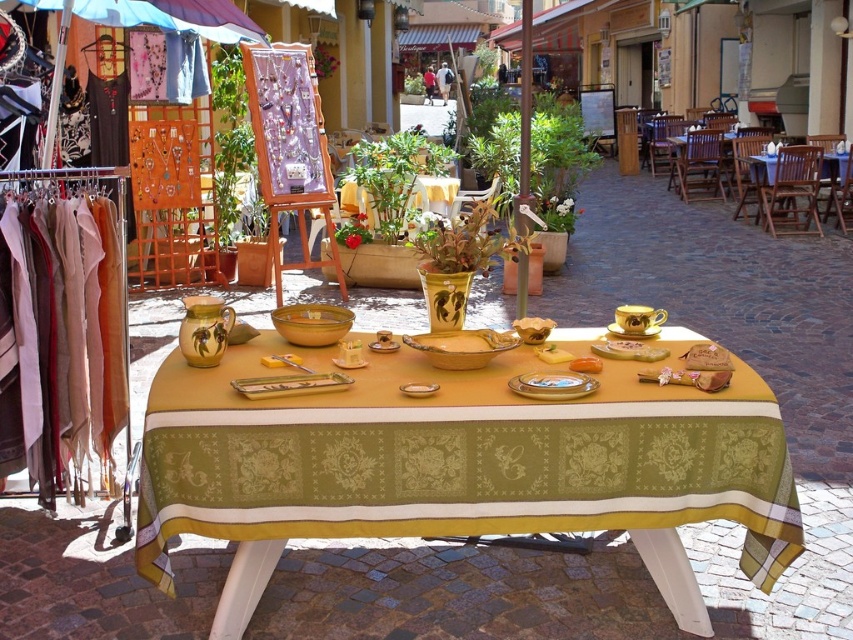
You are a vendor at the market and want to place a new item between the yellow ceramic vase at center and the gold metallic platter at center. Is there enough space for an item that is 6 meters long?

The distance between the yellow ceramic vase at center and the gold metallic platter at center is 5.73 meters, which is slightly shorter than the 6 meters required. Therefore, there isn not enough space for the item.

You are a customer at the market and want to place an order for the yellow matte plate at center. Where should you go to find the wooden table at right to place your order?

The wooden table at right is located above the yellow matte plate at center, so you should go to the area above the plate to find the table.

You are setting up a small stand at the market and need to place a new item. The wooden table at right can hold larger items, while the yellow matte plate at center is for smaller ones. Which object should you use if you have a large decorative vase?

The wooden table at right is bigger than the yellow matte plate at center, so you should place the large decorative vase on the wooden table at right.